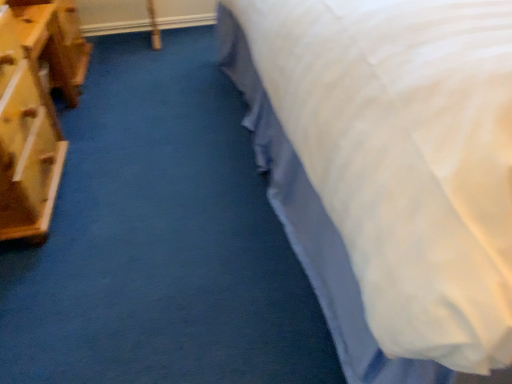
Question: Does white textured bed at upper right turn towards wooden chest of drawers at left?

Choices:
 (A) yes
 (B) no

Answer: (B)

Question: From a real-world perspective, is white textured bed at upper right on top of wooden chest of drawers at left?

Choices:
 (A) yes
 (B) no

Answer: (B)

Question: Is white textured bed at upper right shorter than wooden chest of drawers at left?

Choices:
 (A) no
 (B) yes

Answer: (B)

Question: Is white textured bed at upper right touching wooden chest of drawers at left?

Choices:
 (A) yes
 (B) no

Answer: (B)

Question: Considering the relative sizes of white textured bed at upper right and wooden chest of drawers at left in the image provided, is white textured bed at upper right thinner than wooden chest of drawers at left?

Choices:
 (A) no
 (B) yes

Answer: (A)

Question: Is white textured bed at upper right further to the viewer compared to wooden chest of drawers at left?

Choices:
 (A) no
 (B) yes

Answer: (A)

Question: Can you confirm if wooden chest of drawers at left is taller than white textured bed at upper right?

Choices:
 (A) no
 (B) yes

Answer: (B)

Question: Can you confirm if wooden chest of drawers at left is smaller than white textured bed at upper right?

Choices:
 (A) no
 (B) yes

Answer: (A)

Question: Is wooden chest of drawers at left in front of white textured bed at upper right?

Choices:
 (A) yes
 (B) no

Answer: (B)

Question: From a real-world perspective, is wooden chest of drawers at left located higher than white textured bed at upper right?

Choices:
 (A) yes
 (B) no

Answer: (A)

Question: From the image's perspective, is wooden chest of drawers at left below white textured bed at upper right?

Choices:
 (A) no
 (B) yes

Answer: (A)

Question: Is wooden chest of drawers at left wider than white textured bed at upper right?

Choices:
 (A) yes
 (B) no

Answer: (B)

Question: Considering the positions of point (274, 29) and point (51, 110), is point (274, 29) closer or farther from the camera than point (51, 110)?

Choices:
 (A) closer
 (B) farther

Answer: (A)